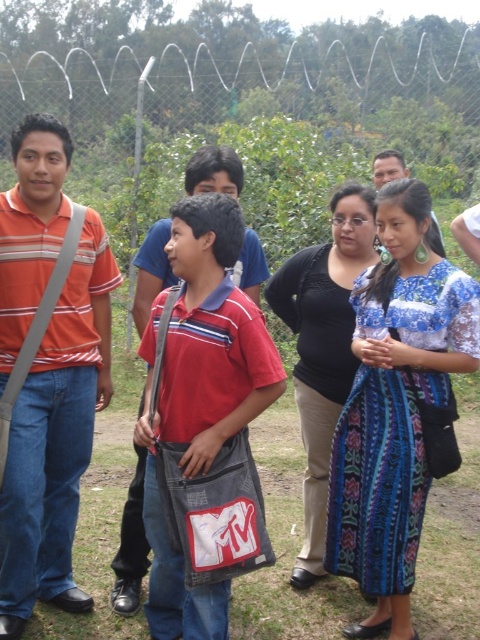
Find the location of `black matte dress at center`. black matte dress at center is located at coordinates (323, 348).

Measure the distance between point [371,216] and camera.

4.03 meters

Find the location of a particular element. The image size is (480, 640). black matte dress at center is located at coordinates (323, 348).

Locate an element on the screen. black matte dress at center is located at coordinates (323, 348).

Is blue woven skirt at center positioned behind denim jeans at center?

No, blue woven skirt at center is closer to the viewer.

From the picture: Is blue woven skirt at center thinner than denim jeans at center?

Incorrect, blue woven skirt at center's width is not less than denim jeans at center's.

Where is `blue woven skirt at center`? The image size is (480, 640). blue woven skirt at center is located at coordinates (396, 403).

Where is `blue woven skirt at center`? The height and width of the screenshot is (640, 480). blue woven skirt at center is located at coordinates (396, 403).

Between blue woven skirt at center and matte black shirt at center, which one is positioned higher?

Positioned higher is matte black shirt at center.

Is point (407, 276) in front of point (382, 168)?

That is True.

The height and width of the screenshot is (640, 480). Describe the element at coordinates (396, 403) in the screenshot. I see `blue woven skirt at center` at that location.

Identify the location of blue woven skirt at center. (396, 403).